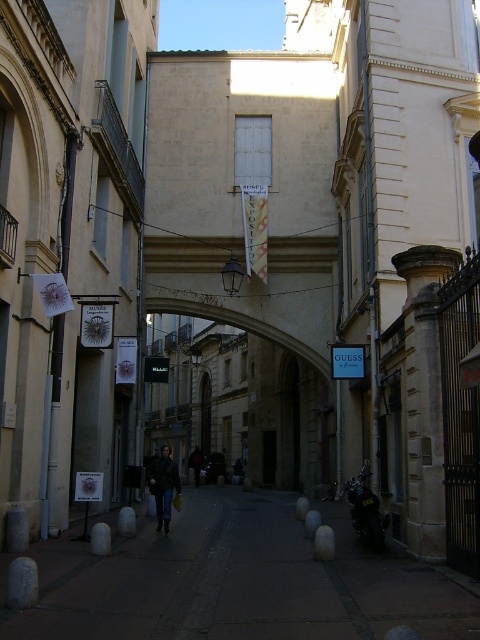
Question: Estimate the real-world distances between objects in this image. Which object is farther from the dark stone alley at center?

Choices:
 (A) dark blue jeans at center
 (B) beige stone archway at center

Answer: (A)

Question: Does beige stone archway at center have a greater width compared to dark blue jeans at center?

Choices:
 (A) yes
 (B) no

Answer: (A)

Question: In this image, where is beige stone archway at center located relative to dark brown leather jacket at center?

Choices:
 (A) above
 (B) below

Answer: (A)

Question: Considering the relative positions of dark brown leather jacket at center and dark blue jeans at center in the image provided, where is dark brown leather jacket at center located with respect to dark blue jeans at center?

Choices:
 (A) left
 (B) right

Answer: (A)

Question: Which of the following is the closest to the observer?

Choices:
 (A) dark stone alley at center
 (B) dark brown leather jacket at center
 (C) beige stone archway at center

Answer: (A)

Question: Which point is closer to the camera?

Choices:
 (A) (156, 512)
 (B) (56, 628)
 (C) (194, 474)

Answer: (B)